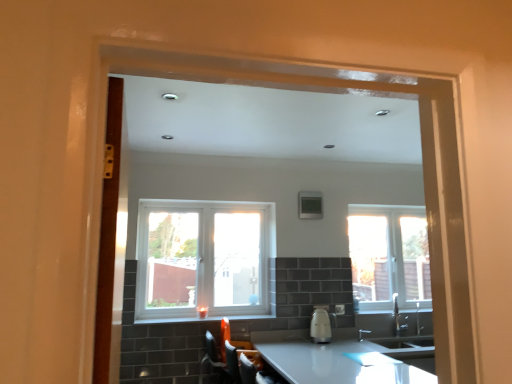
Question: Looking at the image, does clear glass window at right, the second window viewed from the front, seem bigger or smaller compared to white glossy kettle at center?

Choices:
 (A) small
 (B) big

Answer: (B)

Question: Looking at their shapes, would you say clear glass window at right, which appears as the 1th window when viewed from the right, is wider or thinner than white glossy kettle at center?

Choices:
 (A) wide
 (B) thin

Answer: (B)

Question: Which of these objects is positioned farthest from the white glossy countertop at lower center?

Choices:
 (A) white glossy window sill at center
 (B) white plastic window at center, arranged as the 2th window when viewed from the right
 (C) clear glass window at right, which appears as the 1th window when viewed from the right
 (D) white glossy kettle at center

Answer: (B)

Question: Which of these objects is positioned closest to the white glossy window sill at center?

Choices:
 (A) white glossy kettle at center
 (B) clear glass window at right, which ranks as the second window in left-to-right order
 (C) white glossy countertop at lower center
 (D) white plastic window at center, arranged as the first window when viewed from the left

Answer: (D)